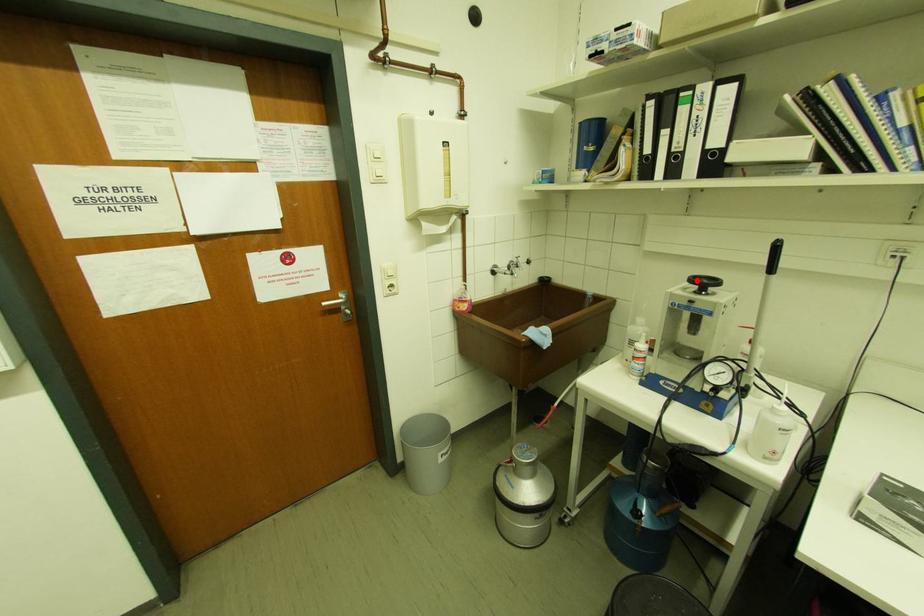
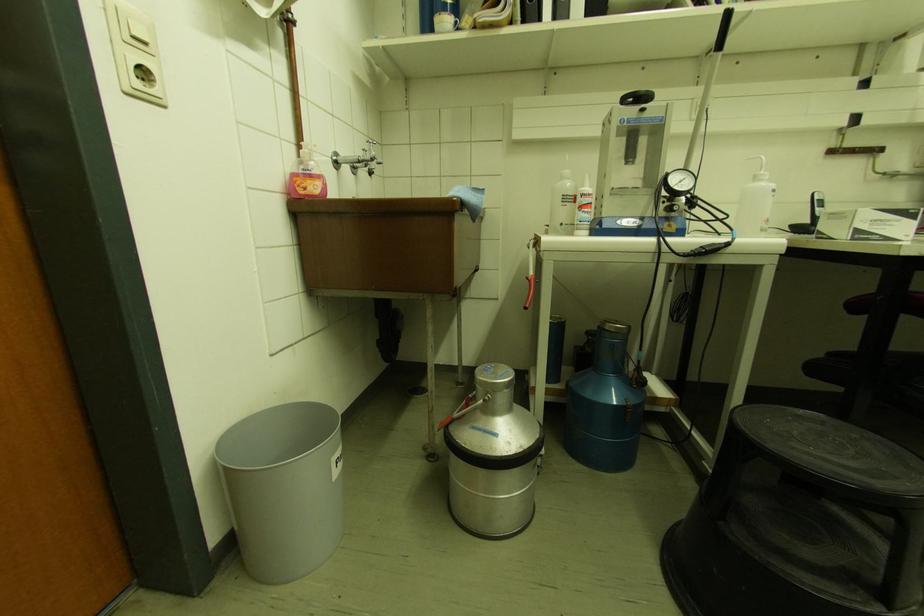
Find the pixel in the second image that matches the highlighted location in the first image.

(628, 100)